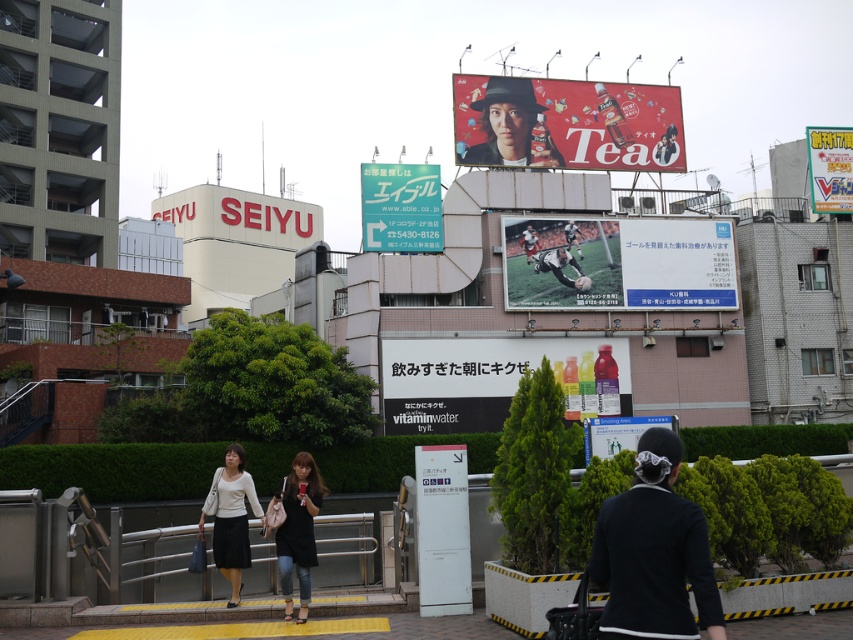
Who is more distant from viewer, (x=556, y=380) or (x=840, y=138)?

The point (x=840, y=138) is more distant.

Is white plastic vitaminwater bottle at center below bright yellow sign at upper right?

Indeed, white plastic vitaminwater bottle at center is positioned under bright yellow sign at upper right.

Which is behind, point (621, 381) or point (817, 208)?

Point (817, 208)

You are a GUI agent. You are given a task and a screenshot of the screen. Output one action in this format:
    pyautogui.click(x=<x>, y=<y>)
    Task: Click on the white plastic vitaminwater bottle at center
    Image resolution: width=853 pixels, height=640 pixels.
    Given the screenshot: What is the action you would take?
    pyautogui.click(x=496, y=380)

Does matte red billboard at upper center have a smaller size compared to white plastic vitaminwater bottle at center?

Indeed, matte red billboard at upper center has a smaller size compared to white plastic vitaminwater bottle at center.

Is point (491, 116) positioned behind point (628, 387)?

Yes.

I want to click on matte red billboard at upper center, so click(566, 124).

What do you see at coordinates (509, 125) in the screenshot? This screenshot has width=853, height=640. I see `matte black hat at upper center` at bounding box center [509, 125].

Who is lower down, matte black hat at upper center or black leather soccer player at center?

black leather soccer player at center is below.

Who is more distant from viewer, (529, 93) or (576, 266)?

Point (529, 93)

What are the coordinates of `matte black hat at upper center` in the screenshot? It's located at (509, 125).